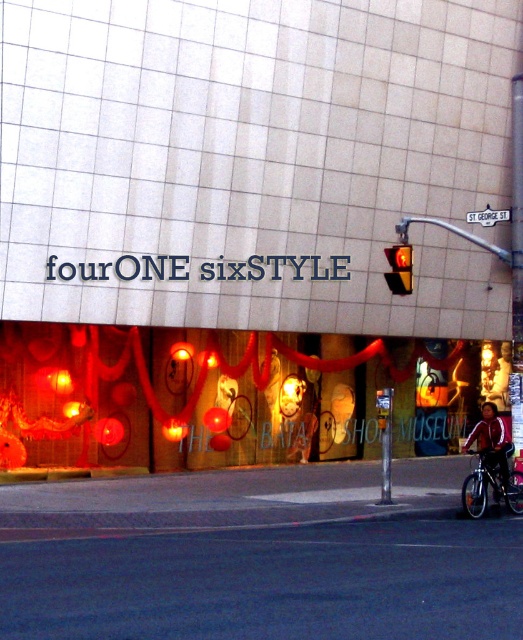
Question: Is shiny black bicycle at lower right wider than amber glass traffic light at center?

Choices:
 (A) yes
 (B) no

Answer: (A)

Question: Which of the following is the farthest from the observer?

Choices:
 (A) amber glass traffic light at center
 (B) shiny black bicycle at lower right

Answer: (A)

Question: Is shiny black bicycle at lower right behind amber glass traffic light at center?

Choices:
 (A) no
 (B) yes

Answer: (A)

Question: Which object is closer to the camera taking this photo?

Choices:
 (A) shiny black bicycle at lower right
 (B) amber glass traffic light at center

Answer: (A)

Question: Does shiny black bicycle at lower right appear under amber glass traffic light at center?

Choices:
 (A) no
 (B) yes

Answer: (B)